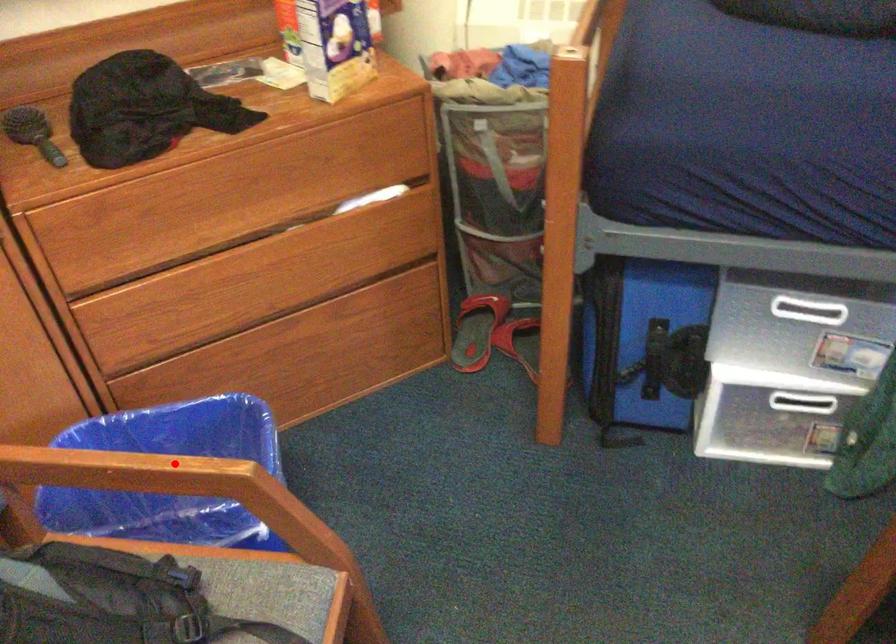
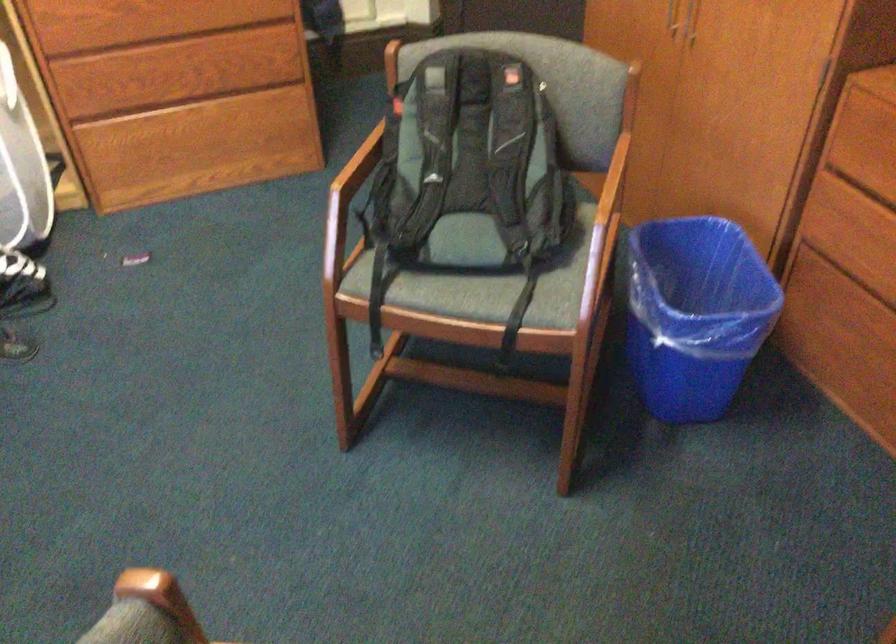
Question: I am providing you with two images of the same scene from different viewpoints. In image1, a red point is highlighted. Considering the same 3D point in image2, which of the following is correct?

Choices:
 (A) It is closer
 (B) It is farther

Answer: (B)